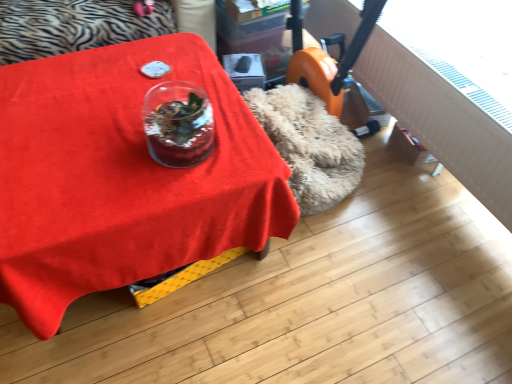
Question: Are matte red tablecloth at center and transparent glass vase at center far apart?

Choices:
 (A) yes
 (B) no

Answer: (B)

Question: Can you confirm if matte red tablecloth at center is smaller than transparent glass vase at center?

Choices:
 (A) no
 (B) yes

Answer: (A)

Question: Is matte red tablecloth at center at the left side of transparent glass vase at center?

Choices:
 (A) yes
 (B) no

Answer: (A)

Question: From the image's perspective, is matte red tablecloth at center above transparent glass vase at center?

Choices:
 (A) yes
 (B) no

Answer: (B)

Question: From a real-world perspective, is matte red tablecloth at center on top of transparent glass vase at center?

Choices:
 (A) yes
 (B) no

Answer: (B)

Question: Is matte red tablecloth at center outside of transparent glass vase at center?

Choices:
 (A) yes
 (B) no

Answer: (A)

Question: Could you tell me if transparent glass vase at center is turned towards matte red tablecloth at center?

Choices:
 (A) yes
 (B) no

Answer: (B)

Question: Is the position of transparent glass vase at center more distant than that of matte red tablecloth at center?

Choices:
 (A) yes
 (B) no

Answer: (A)

Question: From a real-world perspective, is transparent glass vase at center on top of matte red tablecloth at center?

Choices:
 (A) yes
 (B) no

Answer: (A)

Question: Is transparent glass vase at center thinner than matte red tablecloth at center?

Choices:
 (A) yes
 (B) no

Answer: (A)

Question: Considering the relative positions of transparent glass vase at center and matte red tablecloth at center in the image provided, is transparent glass vase at center to the right of matte red tablecloth at center from the viewer's perspective?

Choices:
 (A) yes
 (B) no

Answer: (A)

Question: Can you confirm if transparent glass vase at center is bigger than matte red tablecloth at center?

Choices:
 (A) no
 (B) yes

Answer: (A)

Question: In the image, is matte red tablecloth at center positioned in front of or behind transparent glass vase at center?

Choices:
 (A) front
 (B) behind

Answer: (A)